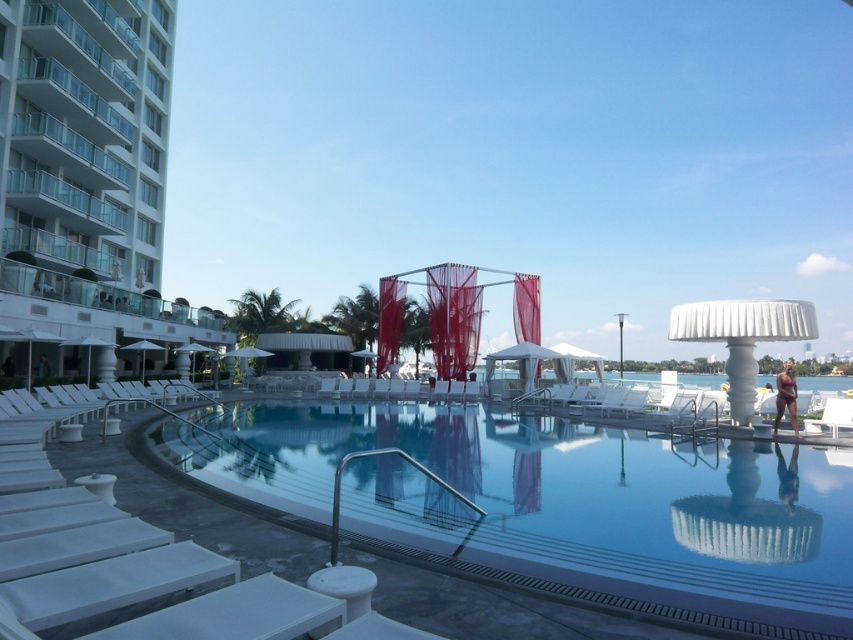
Does clear glass pool at center have a greater height compared to white glass building at left?

No.

Is clear glass pool at center below white glass building at left?

Indeed, clear glass pool at center is positioned under white glass building at left.

Where is `clear glass pool at center`? The width and height of the screenshot is (853, 640). clear glass pool at center is located at coordinates (555, 504).